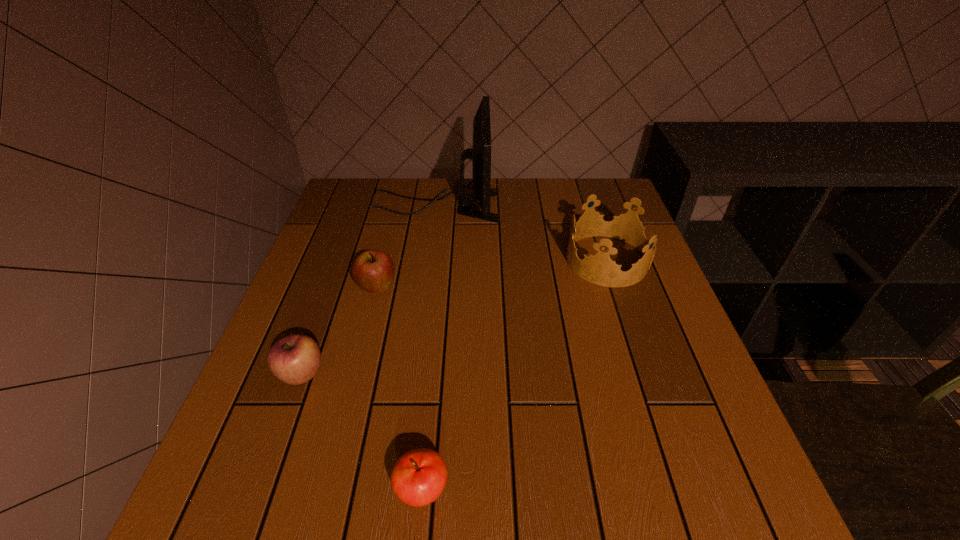
Locate an element on the screen. This screenshot has height=540, width=960. free region at the near edge of the desktop is located at coordinates (319, 482).

Where is `vacant area at the left edge of the desktop`? This screenshot has width=960, height=540. vacant area at the left edge of the desktop is located at coordinates (301, 313).

In the image, there is a desktop. Where is `vacant area at the right edge`? vacant area at the right edge is located at coordinates coord(672,369).

Find the location of a particular element. free region at the far left corner of the desktop is located at coordinates (369, 179).

In the image, there is a desktop. At what (x,y) coordinates should I click in order to perform the action: click on free region at the far right corner. Please return your answer as a coordinate pair (x, y). Image resolution: width=960 pixels, height=540 pixels. Looking at the image, I should click on (590, 187).

Locate an element on the screen. The height and width of the screenshot is (540, 960). free spot between the shortest object and the second nearest object is located at coordinates (362, 432).

What are the coordinates of `free area in between the second nearest apple and the rightmost object` in the screenshot? It's located at (454, 317).

The height and width of the screenshot is (540, 960). In order to click on free space that is in between the farthest apple and the tiara in this screenshot , I will do `click(492, 274)`.

Where is `vacant space that's between the second apple from left to right and the computer monitor`? vacant space that's between the second apple from left to right and the computer monitor is located at coordinates (406, 247).

Locate an element on the screen. This screenshot has height=540, width=960. vacant space in between the shortest apple and the farthest apple is located at coordinates (399, 389).